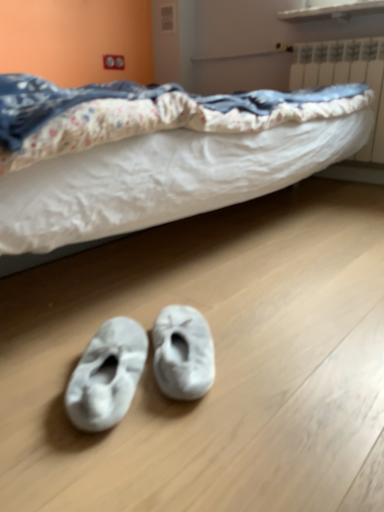
Find the location of a particular element. This screenshot has height=512, width=384. free area behind white fuzzy slippers at lower center, the 1th footwear viewed from the right is located at coordinates (190, 306).